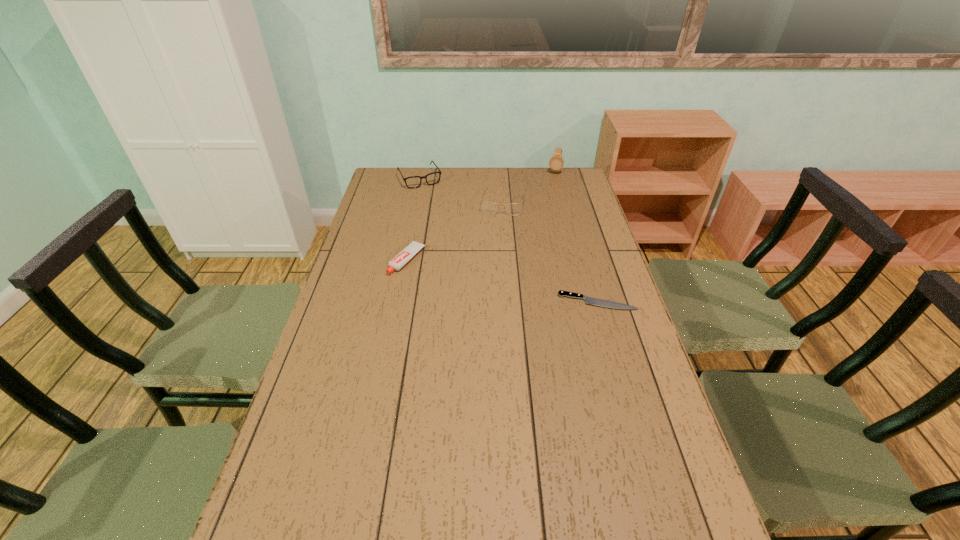
Identify the location of free space located 0.340m on the front-facing side of the third object from left to right. (492, 271).

Where is `blank space located on the front-facing side of the third object from left to right`? Image resolution: width=960 pixels, height=540 pixels. blank space located on the front-facing side of the third object from left to right is located at coordinates [499, 232].

What are the coordinates of `free spot located 0.210m on the front-facing side of the third object from left to right` in the screenshot? It's located at (496, 247).

Locate an element on the screen. The height and width of the screenshot is (540, 960). blank space located on the front-facing side of the farther spectacles is located at coordinates (455, 235).

Image resolution: width=960 pixels, height=540 pixels. Find the location of `vacant space located on the front-facing side of the farther spectacles`. vacant space located on the front-facing side of the farther spectacles is located at coordinates (432, 198).

Locate an element on the screen. The image size is (960, 540). vacant region located on the front-facing side of the farther spectacles is located at coordinates (442, 214).

Identify the location of vacant point located 0.190m on the face of the watch. This screenshot has height=540, width=960. (548, 197).

Where is `free spot located 0.160m on the face of the watch`? The image size is (960, 540). free spot located 0.160m on the face of the watch is located at coordinates (549, 194).

Where is `vacant space located on the face of the watch`? vacant space located on the face of the watch is located at coordinates (541, 219).

Identify the location of watch that is positioned at the far edge. (556, 162).